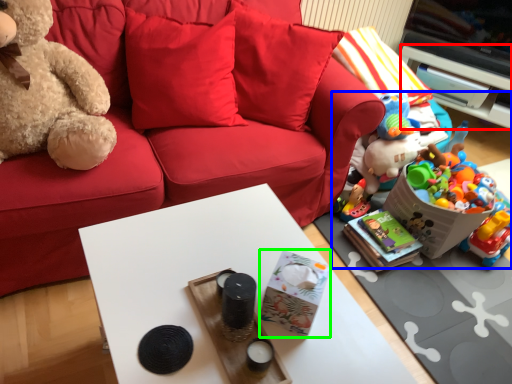
Question: Which is farther away from cabinetry (highlighted by a red box)? toy (highlighted by a blue box) or box (highlighted by a green box)?

Choices:
 (A) toy
 (B) box

Answer: (B)